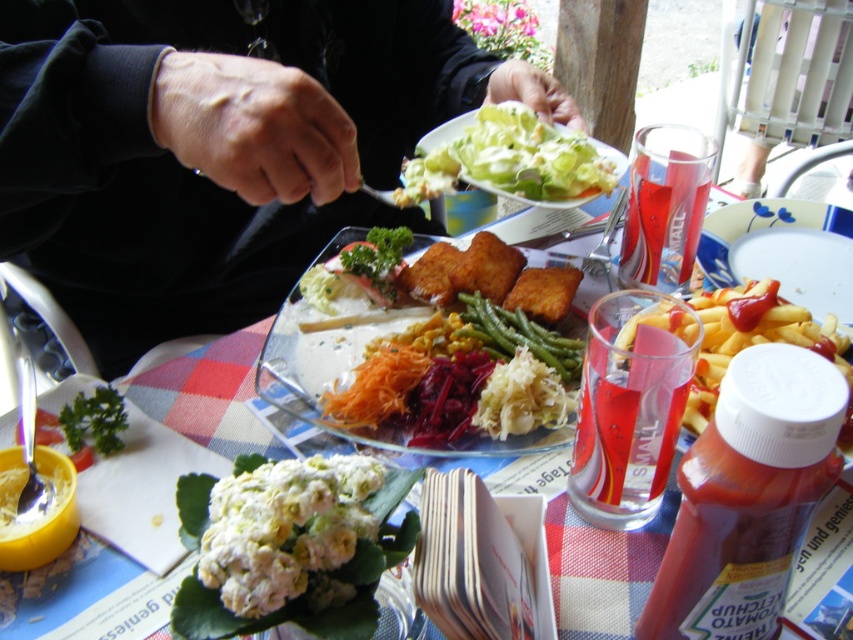
You are a customer at this outdoor dining table. You want to reach for the golden crispy fish at center and the white creamy salad at upper center. Which one is located to the left of the other?

The golden crispy fish at center is positioned on the left side of white creamy salad at upper center, so the golden crispy fish at center is to the left of the white creamy salad at upper center.

You are a server at this outdoor restaurant, and you need to place a 40 cm wide platter of appetizers on the table. The golden crispy fish at center is currently occupying the center. Can you place the platter there without moving the fish?

The golden crispy fish at center and viewer are 43.95 centimeters apart. Since the platter is 40 cm wide, it can be placed there as the distance between the fish and the viewer is greater than the platter width, but you might need to adjust the fish slightly to center the platter properly.

You are a customer at the outdoor restaurant and want to place your napkin on the table. If you want to put it exactly where the golden crispy fish at center is currently located, where should you place it relative to the glass dish with vegetables and the vase with flowers?

The golden crispy fish at center is located at point coordinates, so you should place your napkin at the coordinates specified relative to the glass dish and vase.